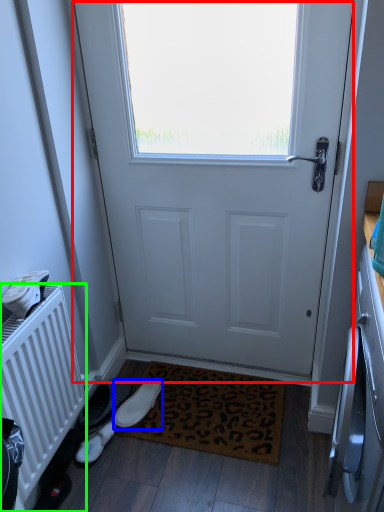
Question: Which is nearer to the door (highlighted by a red box)? footwear (highlighted by a blue box) or radiator (highlighted by a green box).

Choices:
 (A) footwear
 (B) radiator

Answer: (B)